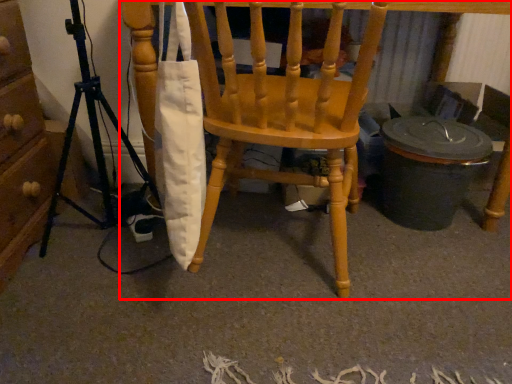
Question: Considering the relative positions of chair (annotated by the red box) and tripod in the image provided, where is chair (annotated by the red box) located with respect to the staircase?

Choices:
 (A) left
 (B) right

Answer: (B)